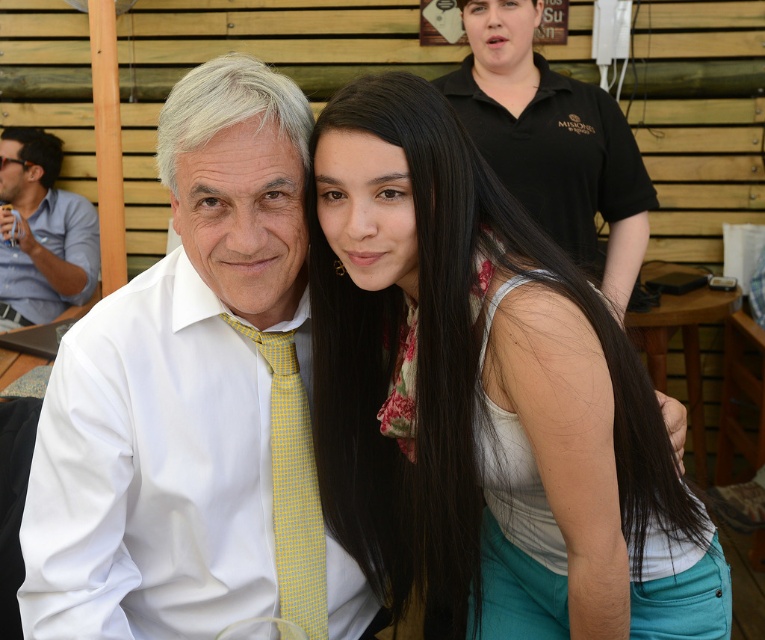
Image resolution: width=765 pixels, height=640 pixels. Describe the element at coordinates (194, 403) in the screenshot. I see `white smooth shirt at center` at that location.

This screenshot has height=640, width=765. What are the coordinates of `white smooth shirt at center` in the screenshot? It's located at (194, 403).

You are a GUI agent. You are given a task and a screenshot of the screen. Output one action in this format:
    pyautogui.click(x=<x>, y=<y>)
    Task: Click on the white smooth shirt at center
    This screenshot has height=640, width=765.
    Given the screenshot: What is the action you would take?
    pyautogui.click(x=194, y=403)

Who is positioned more to the left, matte blue shirt at left or yellow checkered tie at center?

From the viewer's perspective, matte blue shirt at left appears more on the left side.

Who is shorter, matte blue shirt at left or yellow checkered tie at center?

Standing shorter between the two is yellow checkered tie at center.

Between point (5, 237) and point (324, 634), which one is positioned in front?

Positioned in front is point (324, 634).

The width and height of the screenshot is (765, 640). Find the location of `matte blue shirt at left`. matte blue shirt at left is located at coordinates [41, 232].

Who is positioned more to the right, white fabric top at center or white smooth shirt at center?

Positioned to the right is white fabric top at center.

Is white fabric top at center further to camera compared to white smooth shirt at center?

No, it is in front of white smooth shirt at center.

Measure the distance between point (x=356, y=516) and camera.

Point (x=356, y=516) and camera are 1.25 meters apart from each other.

In order to click on white fabric top at center in this screenshot , I will do `click(487, 397)`.